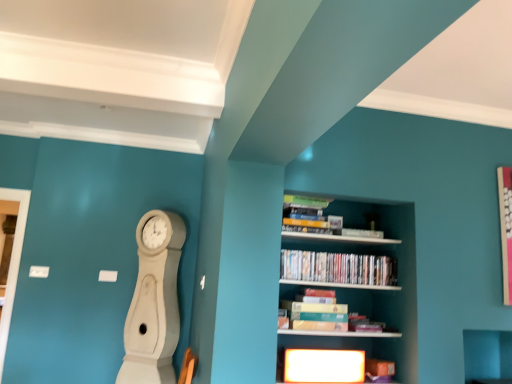
Question: Can you confirm if wooden bookshelf at center is wider than matte plastic dvds at center, placed as the first book when sorted from top to bottom?

Choices:
 (A) yes
 (B) no

Answer: (A)

Question: Does wooden bookshelf at center appear on the left side of matte plastic dvds at center, placed as the first book when sorted from top to bottom?

Choices:
 (A) no
 (B) yes

Answer: (B)

Question: From a real-world perspective, is wooden bookshelf at center physically above matte plastic dvds at center, acting as the second book starting from the bottom?

Choices:
 (A) no
 (B) yes

Answer: (A)

Question: From a real-world perspective, is wooden bookshelf at center below matte plastic dvds at center, placed as the first book when sorted from top to bottom?

Choices:
 (A) no
 (B) yes

Answer: (B)

Question: Considering the relative positions of wooden bookshelf at center and matte plastic dvds at center, acting as the second book starting from the bottom, in the image provided, is wooden bookshelf at center to the right of matte plastic dvds at center, acting as the second book starting from the bottom, from the viewer's perspective?

Choices:
 (A) no
 (B) yes

Answer: (A)

Question: From a real-world perspective, is matte cardboard book at center, placed as the second book when sorted from top to bottom, positioned above or below white wood clock at left?

Choices:
 (A) above
 (B) below

Answer: (A)

Question: Is matte cardboard book at center, placed as the second book when sorted from top to bottom, bigger or smaller than white wood clock at left?

Choices:
 (A) big
 (B) small

Answer: (B)

Question: Is matte cardboard book at center, which appears as the first book when ordered from the bottom, to the left or to the right of white wood clock at left in the image?

Choices:
 (A) right
 (B) left

Answer: (A)

Question: Is point (340, 316) positioned closer to the camera than point (152, 281)?

Choices:
 (A) closer
 (B) farther

Answer: (A)

Question: Considering the positions of point (283, 258) and point (406, 344), is point (283, 258) closer or farther from the camera than point (406, 344)?

Choices:
 (A) farther
 (B) closer

Answer: (A)

Question: Is matte plastic dvds at center, acting as the second book starting from the bottom, taller or shorter than wooden bookshelf at center?

Choices:
 (A) short
 (B) tall

Answer: (A)

Question: From the image's perspective, is matte plastic dvds at center, acting as the second book starting from the bottom, positioned above or below wooden bookshelf at center?

Choices:
 (A) below
 (B) above

Answer: (B)

Question: Relative to wooden bookshelf at center, is matte plastic dvds at center, acting as the second book starting from the bottom, in front or behind?

Choices:
 (A) behind
 (B) front

Answer: (A)

Question: Does point (333, 317) appear closer or farther from the camera than point (292, 266)?

Choices:
 (A) closer
 (B) farther

Answer: (B)

Question: Is matte cardboard book at center, which appears as the first book when ordered from the bottom, wider or thinner than matte plastic dvds at center, acting as the second book starting from the bottom?

Choices:
 (A) wide
 (B) thin

Answer: (A)